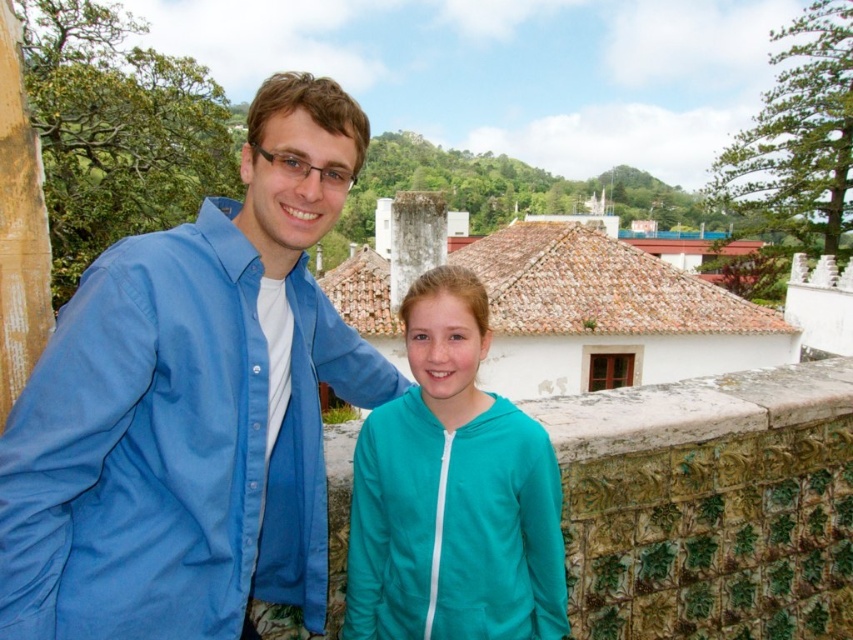
Is point (320, 474) positioned after point (485, 550)?

Yes, it is behind point (485, 550).

Is blue cotton shirt at left further to the viewer compared to teal fleece jacket at center?

No.

Between point (161, 458) and point (488, 532), which one is positioned behind?

The point (488, 532) is behind.

This screenshot has height=640, width=853. Identify the location of blue cotton shirt at left. tap(192, 406).